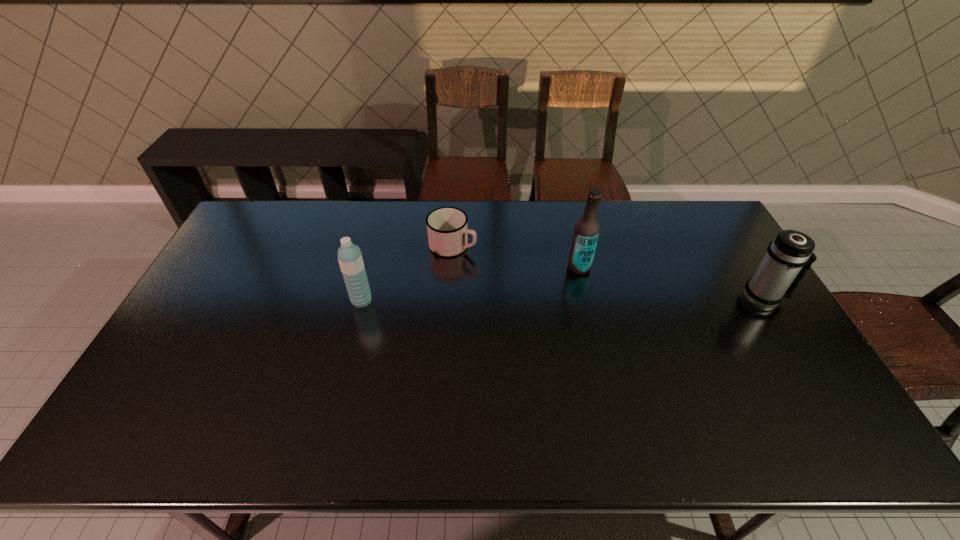
Identify the location of the leftmost object. Image resolution: width=960 pixels, height=540 pixels. (350, 259).

Locate an element on the screen. thermos bottle is located at coordinates (775, 278).

This screenshot has height=540, width=960. What are the coordinates of `the third nearest object` in the screenshot? It's located at (586, 232).

At what (x,y) coordinates should I click in order to perform the action: click on beer bottle. Please return your answer as a coordinate pair (x, y). Looking at the image, I should click on (586, 232).

The width and height of the screenshot is (960, 540). Identify the location of the farthest object. (447, 229).

Locate an element on the screen. the second object from left to right is located at coordinates (447, 229).

Identify the location of vacant space located 0.300m on the back of the leftmost object. The width and height of the screenshot is (960, 540). (379, 231).

In order to click on free location located on the side of the tallest object with the label in this screenshot , I will do `click(514, 308)`.

Where is `vacant region located 0.120m on the side of the tallest object with the label`? This screenshot has width=960, height=540. vacant region located 0.120m on the side of the tallest object with the label is located at coordinates (544, 289).

Where is `vacant space located on the side of the tallest object with the label`? vacant space located on the side of the tallest object with the label is located at coordinates (476, 332).